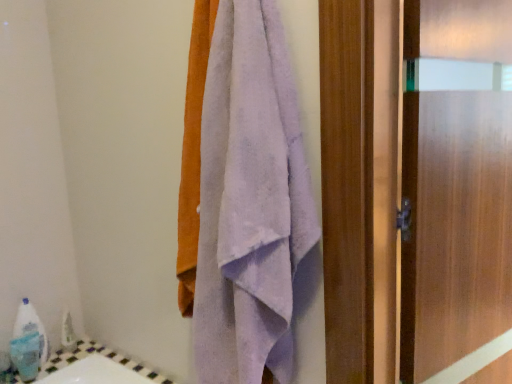
Question: Relative to lavender soft towel at center, is frosted glass door at right in front or behind?

Choices:
 (A) behind
 (B) front

Answer: (A)

Question: From their relative heights in the image, would you say frosted glass door at right is taller or shorter than lavender soft towel at center?

Choices:
 (A) tall
 (B) short

Answer: (A)

Question: Considering the positions of point (425, 271) and point (206, 193), is point (425, 271) closer or farther from the camera than point (206, 193)?

Choices:
 (A) farther
 (B) closer

Answer: (A)

Question: In the image, is lavender soft towel at center positioned in front of or behind frosted glass door at right?

Choices:
 (A) behind
 (B) front

Answer: (B)

Question: Considering the positions of lavender soft towel at center and frosted glass door at right in the image, is lavender soft towel at center taller or shorter than frosted glass door at right?

Choices:
 (A) short
 (B) tall

Answer: (A)

Question: Is lavender soft towel at center wider or thinner than frosted glass door at right?

Choices:
 (A) wide
 (B) thin

Answer: (A)

Question: Based on their sizes in the image, would you say lavender soft towel at center is bigger or smaller than frosted glass door at right?

Choices:
 (A) big
 (B) small

Answer: (B)